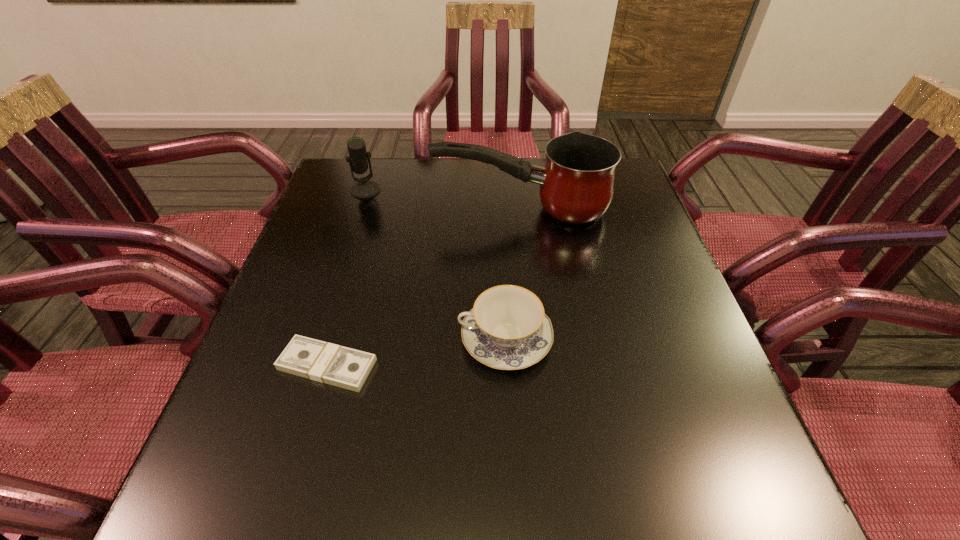
Identify the location of vacant space located with the handle on the side of the chinaware. (404, 339).

Where is `vacant area situated 0.080m on the back of the dollar`? The height and width of the screenshot is (540, 960). vacant area situated 0.080m on the back of the dollar is located at coordinates (344, 310).

What are the coordinates of `saucepan that is at the far edge` in the screenshot? It's located at (577, 183).

Locate an element on the screen. microphone that is at the far edge is located at coordinates (364, 188).

Where is `microphone present at the left edge`? The height and width of the screenshot is (540, 960). microphone present at the left edge is located at coordinates (364, 188).

Locate an element on the screen. dollar that is at the left edge is located at coordinates (340, 366).

Identify the location of object located in the right edge section of the desktop. Image resolution: width=960 pixels, height=540 pixels. (577, 183).

Where is `object at the far left corner`? object at the far left corner is located at coordinates (364, 188).

The height and width of the screenshot is (540, 960). I want to click on object at the far right corner, so click(577, 183).

The width and height of the screenshot is (960, 540). In order to click on vacant space at the far edge of the desktop in this screenshot , I will do `click(451, 186)`.